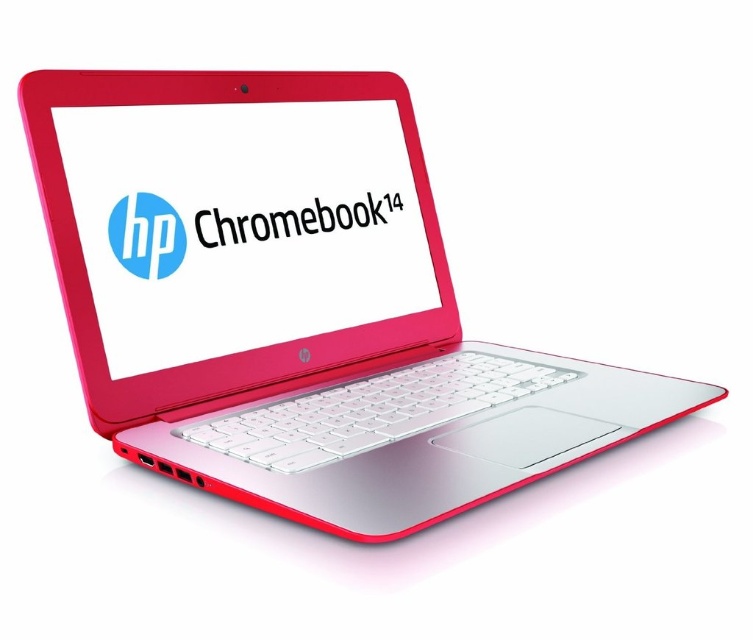
Is point (343, 524) behind point (122, 156)?

That is False.

Consider the image. Between matte plastic laptop at center and matte plastic screen at center, which one is positioned lower?

matte plastic laptop at center is lower down.

Who is more distant from viewer, (120, 180) or (175, 176)?

The point (175, 176) is more distant.

Find the location of a particular element. The width and height of the screenshot is (753, 640). matte plastic laptop at center is located at coordinates (299, 307).

Is matte plastic laptop at center wider than matte plastic logo at center?

Yes, matte plastic laptop at center is wider than matte plastic logo at center.

How distant is matte plastic laptop at center from matte plastic logo at center?

matte plastic laptop at center is 5.44 inches from matte plastic logo at center.

Between point (398, 241) and point (127, 220), which one is positioned in front?

Point (127, 220) is more forward.

Find the location of a particular element. The image size is (753, 640). matte plastic laptop at center is located at coordinates (299, 307).

Is point (386, 292) closer to camera compared to point (352, 211)?

No, it is not.

Who is more distant from viewer, (175, 323) or (346, 218)?

Point (346, 218)

Does point (215, 243) come behind point (316, 221)?

No, (215, 243) is in front of (316, 221).

The image size is (753, 640). Identify the location of matte plastic screen at center. (242, 225).